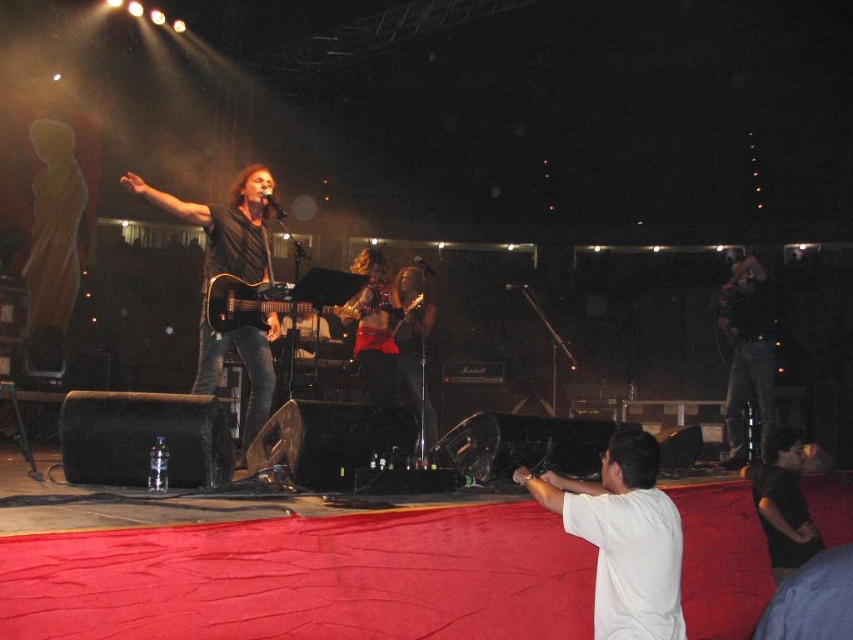
You are a photographer at the concert and need to capture a closeup shot of the white cotton shirt at center and the black matte guitar at center. Since your camera has a limited focus range, which object should you prioritize to ensure it fits within the frame?

The white cotton shirt at center has a larger width than the black matte guitar at center, so you should prioritize capturing the white cotton shirt at center to ensure it fits within the frame.

You are a stagehand who needs to place a large equipment box that measures 1.2 meters in width. You see the black matte guitar at center and the black matte shirt at lower right on stage. Can the equipment box fit between these two objects?

The black matte guitar at center is larger in size than the black matte shirt at lower right, but the exact distance between them is not specified. Without knowing the spacing between the two objects, it is impossible to determine if the equipment box will fit.

You are a stagehand at the concert and need to place a 1.5 meter long banner horizontally on the stage floor. The banner must be placed exactly at the same 2D location as the black matte guitar at center. Since the guitar is only 1 meter wide, will the banner cover the guitar completely?

The banner will cover the black matte guitar at center completely because the banner is longer than the guitar in width.